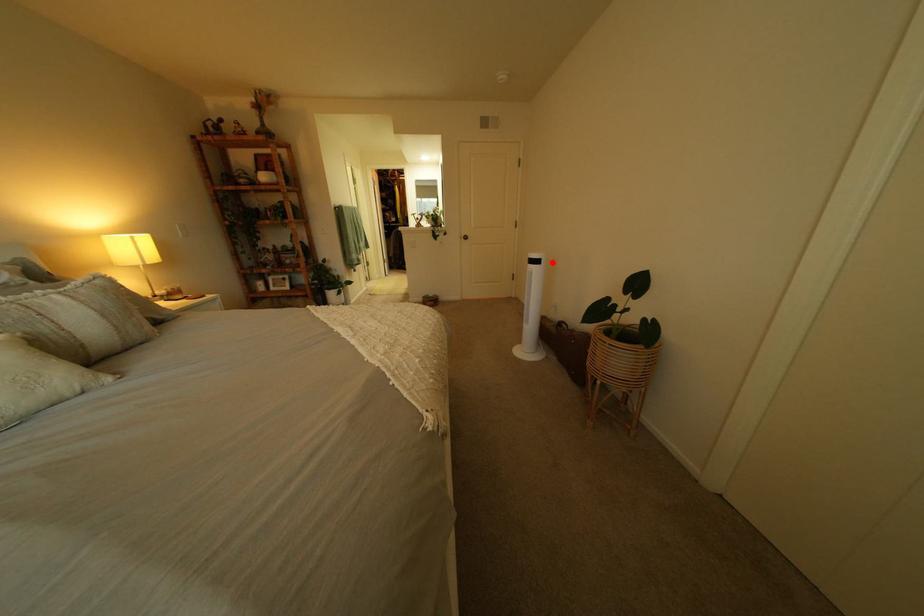
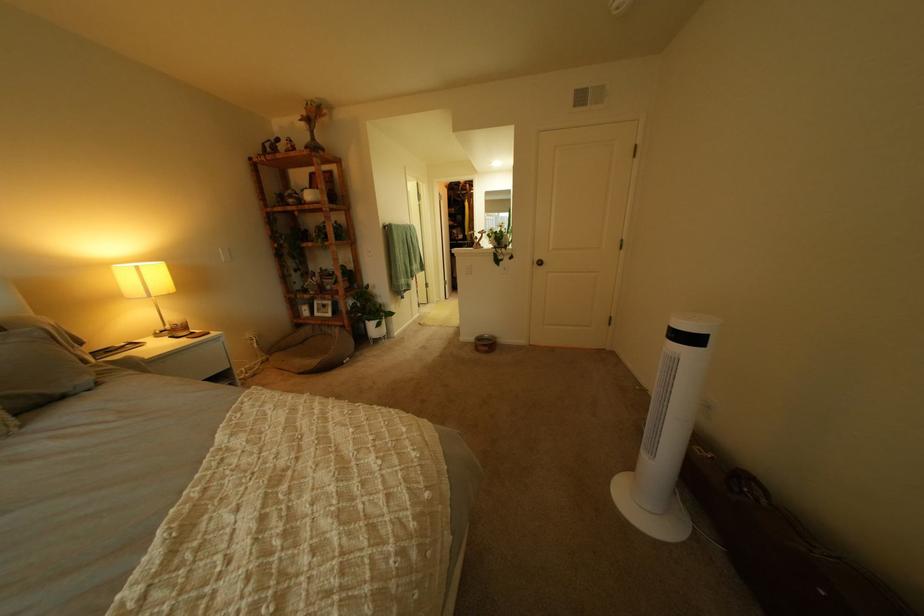
Where in the second image is the point corresponding to the highlighted location from the first image?

(710, 341)